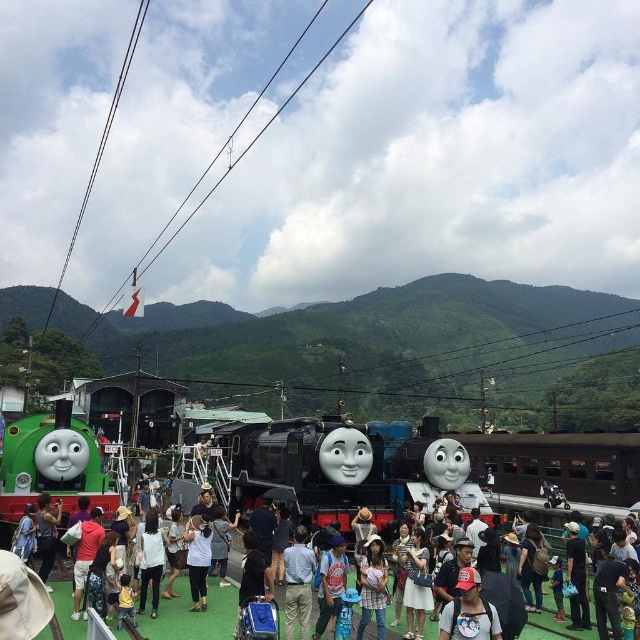
Question: Is matte black train at center positioned before white cotton shirt at center?

Choices:
 (A) no
 (B) yes

Answer: (B)

Question: Considering the real-world distances, which object is farthest from the matte black train at center?

Choices:
 (A) white cotton cap at center
 (B) white cotton shirt at center

Answer: (A)

Question: Estimate the real-world distances between objects in this image. Which object is closer to the matte black train at center?

Choices:
 (A) white cotton shirt at center
 (B) white cotton cap at center

Answer: (A)

Question: Among these points, which one is farthest from the camera?

Choices:
 (A) (483, 627)
 (B) (593, 628)

Answer: (B)

Question: Considering the relative positions of matte black train at center and white cotton cap at center in the image provided, where is matte black train at center located with respect to white cotton cap at center?

Choices:
 (A) right
 (B) left

Answer: (B)

Question: Is matte black train at center positioned behind white cotton cap at center?

Choices:
 (A) no
 (B) yes

Answer: (B)